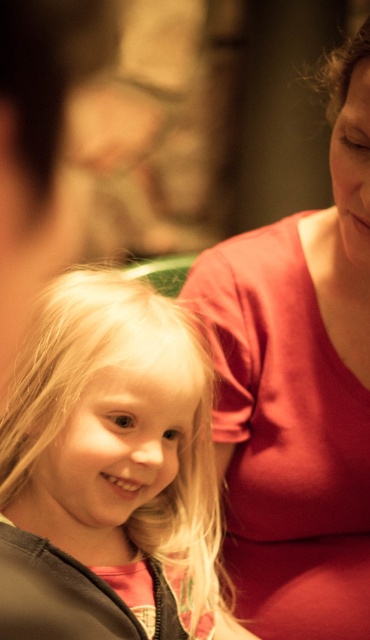
Is point (290, 408) positioned after point (109, 570)?

Yes, point (290, 408) is farther from viewer.

Is point (311, 403) positioned in front of point (22, 376)?

No.

Does point (331, 284) lie in front of point (190, 628)?

No.

Locate an element on the screen. Image resolution: width=370 pixels, height=640 pixels. matte red shirt at upper right is located at coordinates (298, 388).